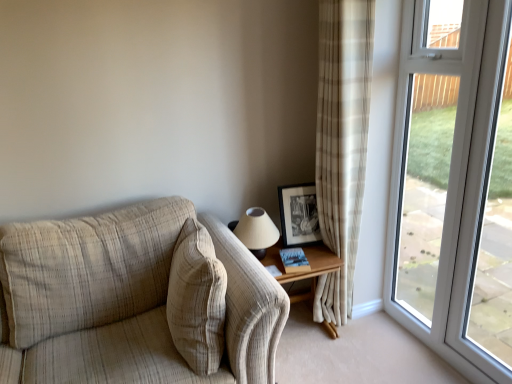
At what (x,y) coordinates should I click in order to perform the action: click on transparent glass window at right. Please return your answer as a coordinate pair (x, y). Image resolution: width=512 pixels, height=384 pixels. Looking at the image, I should click on pyautogui.click(x=485, y=207).

What are the coordinates of `hardcover book at lower right` in the screenshot? It's located at (294, 260).

Where is `wooden table at right`? wooden table at right is located at coordinates (304, 272).

What do you see at coordinates (425, 184) in the screenshot? I see `transparent glass screen door at right` at bounding box center [425, 184].

Image resolution: width=512 pixels, height=384 pixels. I want to click on transparent glass window at right, so click(485, 207).

Is beige textured pillow at center to the right of beige fabric couch at left from the viewer's perspective?

Yes, beige textured pillow at center is to the right of beige fabric couch at left.

Does point (172, 304) lie behind point (240, 260)?

No, it is in front of (240, 260).

Would you say beige textured pillow at center contains beige fabric couch at left?

No.

Does beige textured pillow at center have a lesser height compared to beige fabric couch at left?

Indeed, beige textured pillow at center has a lesser height compared to beige fabric couch at left.

Which of these two, wooden table at right or beige textured pillow at center, is smaller?

With smaller size is beige textured pillow at center.

Which object is thinner, wooden table at right or beige textured pillow at center?

Thinner between the two is beige textured pillow at center.

Would you say wooden table at right is outside beige textured pillow at center?

wooden table at right lies outside beige textured pillow at center's area.

Is point (284, 280) positioned in front of point (202, 237)?

That is False.

Image resolution: width=512 pixels, height=384 pixels. Identify the location of screen door lying on the right of beige textured pillow at center. (425, 184).

From a real-world perspective, is beige textured pillow at center positioned over transparent glass screen door at right based on gravity?

No, from a real-world perspective, beige textured pillow at center is not on top of transparent glass screen door at right.

Can you confirm if beige textured pillow at center is smaller than transparent glass screen door at right?

No, beige textured pillow at center is not smaller than transparent glass screen door at right.

Based on their sizes in the image, would you say wooden table at right is bigger or smaller than beige plaid curtain at right?

Clearly, wooden table at right is smaller in size than beige plaid curtain at right.

From a real-world perspective, relative to beige plaid curtain at right, is wooden table at right vertically above or below?

wooden table at right is below beige plaid curtain at right.

Can you confirm if wooden table at right is positioned to the left of beige plaid curtain at right?

Correct, you'll find wooden table at right to the left of beige plaid curtain at right.

Between point (308, 292) and point (346, 292), which one is positioned behind?

The point (308, 292) is behind.

Is black matte picture frame at upper right oriented towards beige textured pillow at center?

No, black matte picture frame at upper right is not turned towards beige textured pillow at center.

In terms of width, does black matte picture frame at upper right look wider or thinner when compared to beige textured pillow at center?

Clearly, black matte picture frame at upper right has less width compared to beige textured pillow at center.

In the image, is black matte picture frame at upper right positioned in front of or behind beige textured pillow at center?

In the image, black matte picture frame at upper right appears behind beige textured pillow at center.

From a real-world perspective, is black matte picture frame at upper right above or below transparent glass screen door at right?

black matte picture frame at upper right is situated lower than transparent glass screen door at right in the real world.

Which object is closer to the camera taking this photo, black matte picture frame at upper right or transparent glass screen door at right?

transparent glass screen door at right is in front.

Is point (315, 224) behind point (423, 15)?

Yes.

Is black matte picture frame at upper right located outside transparent glass screen door at right?

Yes.

Considering the relative sizes of beige plaid curtain at right and wooden table at right in the image provided, is beige plaid curtain at right shorter than wooden table at right?

In fact, beige plaid curtain at right may be taller than wooden table at right.

You are a GUI agent. You are given a task and a screenshot of the screen. Output one action in this format:
    pyautogui.click(x=<x>, y=<y>)
    Task: Click on the table directly beneath the beige plaid curtain at right (from a real-world perspective)
    The width and height of the screenshot is (512, 384).
    Given the screenshot: What is the action you would take?
    pyautogui.click(x=304, y=272)

The width and height of the screenshot is (512, 384). I want to click on throw pillow behind the beige fabric couch at left, so click(x=197, y=299).

Locate an element on the screen. throw pillow lying in front of the wooden table at right is located at coordinates (197, 299).

When comparing their distances from beige plaid curtain at right, does beige fabric couch at left or transparent glass window at right seem closer?

transparent glass window at right is closer to beige plaid curtain at right.

Estimate the real-world distances between objects in this image. Which object is further from beige textured pillow at center, transparent glass screen door at right or wooden table at right?

transparent glass screen door at right.

From the image, which object appears to be nearer to beige fabric couch at left, wooden table at right or transparent glass screen door at right?

The object closer to beige fabric couch at left is wooden table at right.

Which object lies further to the anchor point transparent glass window at right, wooden table at right or black matte picture frame at upper right?

wooden table at right lies further to transparent glass window at right than the other object.

Estimate the real-world distances between objects in this image. Which object is closer to beige textured pillow at center, wooden table at right or transparent glass window at right?

wooden table at right is positioned closer to the anchor beige textured pillow at center.

Looking at the image, which one is located closer to transparent glass window at right, beige plaid curtain at right or wooden table at right?

Among the two, wooden table at right is located nearer to transparent glass window at right.

Looking at this image, based on their spatial positions, is black matte picture frame at upper right or wooden table at right further from transparent glass screen door at right?

wooden table at right lies further to transparent glass screen door at right than the other object.

When comparing their distances from beige plaid curtain at right, does beige fabric couch at left or beige textured pillow at center seem closer?

beige textured pillow at center is closer to beige plaid curtain at right.

Image resolution: width=512 pixels, height=384 pixels. In order to click on curtain situated between matte cream fabric lampshade at upper right and transparent glass window at right from left to right in this screenshot , I will do `click(342, 143)`.

Locate an element on the screen. throw pillow located between beige fabric couch at left and matte cream fabric lampshade at upper right in the depth direction is located at coordinates (197, 299).

This screenshot has width=512, height=384. Find the location of `table lamp positioned between beige textured pillow at center and wooden table at right from near to far`. table lamp positioned between beige textured pillow at center and wooden table at right from near to far is located at coordinates (256, 231).

The width and height of the screenshot is (512, 384). In order to click on table lamp between beige plaid curtain at right and black matte picture frame at upper right from front to back in this screenshot , I will do `click(256, 231)`.